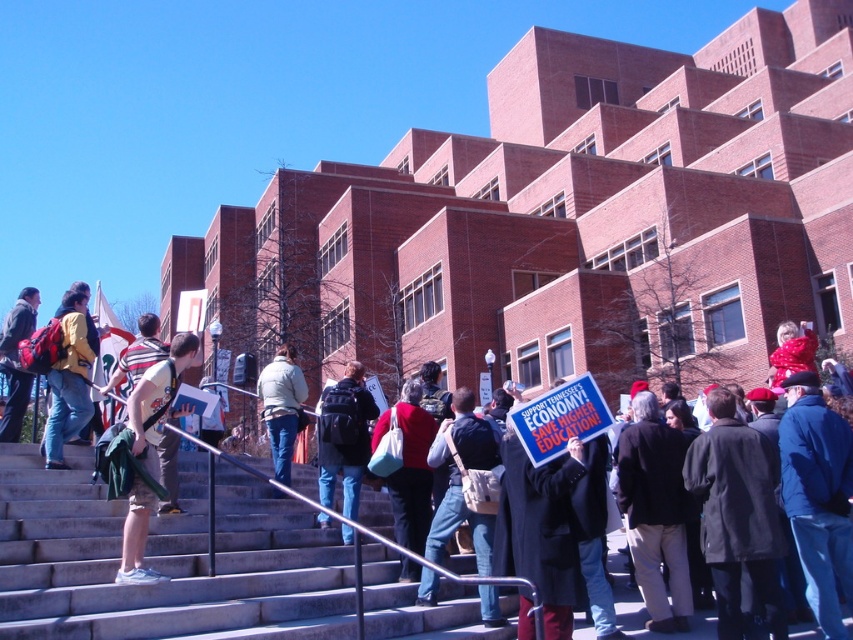
Question: Which of these objects is positioned closest to the matte yellow jacket at center?

Choices:
 (A) gray concrete stairs at center
 (B) khaki shorts at left
 (C) matte black backpack at center

Answer: (B)

Question: Does matte yellow jacket at center have a smaller size compared to light gray jacket at center?

Choices:
 (A) no
 (B) yes

Answer: (A)

Question: Which of these objects is positioned closest to the light gray jacket at center?

Choices:
 (A) matte black backpack at center
 (B) gray concrete stairs at center
 (C) khaki shorts at left
 (D) matte yellow jacket at center

Answer: (A)

Question: Can you confirm if matte black backpack at center is positioned to the right of matte black backpack at left?

Choices:
 (A) yes
 (B) no

Answer: (A)

Question: Does khaki shorts at left appear on the right side of matte yellow jacket at center?

Choices:
 (A) no
 (B) yes

Answer: (B)

Question: Which point is farther from the camera taking this photo?

Choices:
 (A) (30, 332)
 (B) (50, 532)
 (C) (287, 364)
 (D) (73, 314)

Answer: (C)